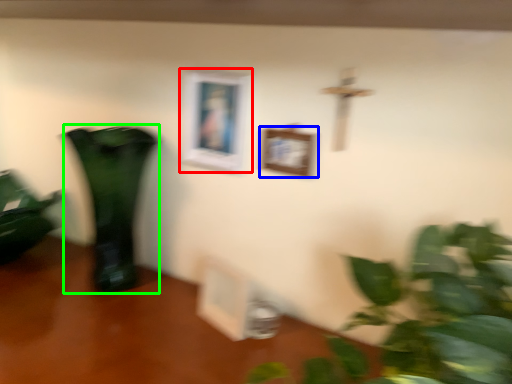
Question: Estimate the real-world distances between objects in this image. Which object is farther from picture frame (highlighted by a red box), picture frame (highlighted by a blue box) or vase (highlighted by a green box)?

Choices:
 (A) picture frame
 (B) vase

Answer: (B)